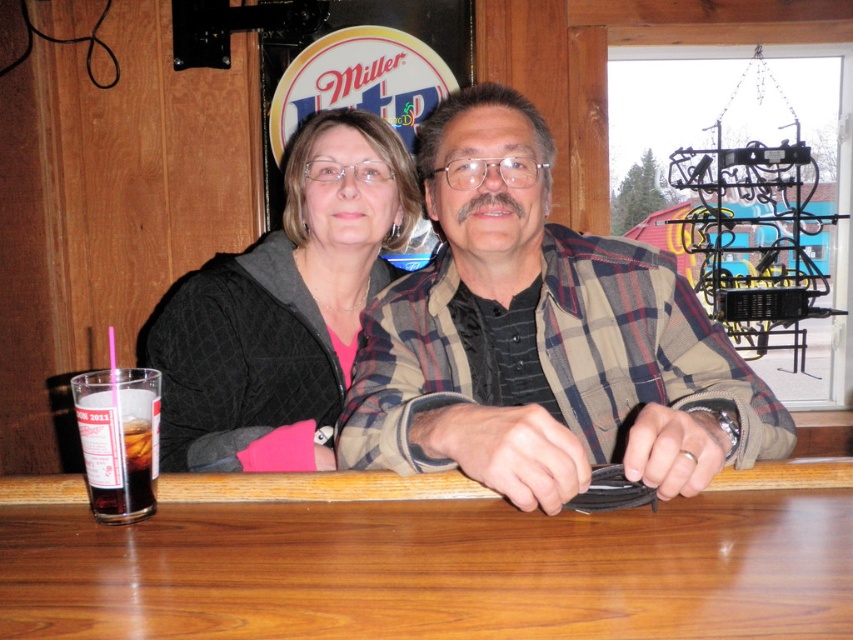
Between point (618, 422) and point (331, 173), which one is positioned in front?

Positioned in front is point (618, 422).

What do you see at coordinates (543, 339) in the screenshot?
I see `plaid flannel shirt at center` at bounding box center [543, 339].

This screenshot has width=853, height=640. Identify the location of plaid flannel shirt at center. (543, 339).

From the picture: Which is more to the left, brown wood table at center or plaid flannel shirt at center?

From the viewer's perspective, brown wood table at center appears more on the left side.

Based on the photo, does brown wood table at center have a greater height compared to plaid flannel shirt at center?

Incorrect, brown wood table at center's height is not larger of plaid flannel shirt at center's.

Identify the location of brown wood table at center. This screenshot has width=853, height=640. (426, 560).

Locate an element on the screen. This screenshot has width=853, height=640. brown wood table at center is located at coordinates (426, 560).

Is brown wood table at center shorter than black quilted jacket at upper left?

Correct, brown wood table at center is not as tall as black quilted jacket at upper left.

This screenshot has height=640, width=853. In order to click on brown wood table at center in this screenshot , I will do `click(426, 560)`.